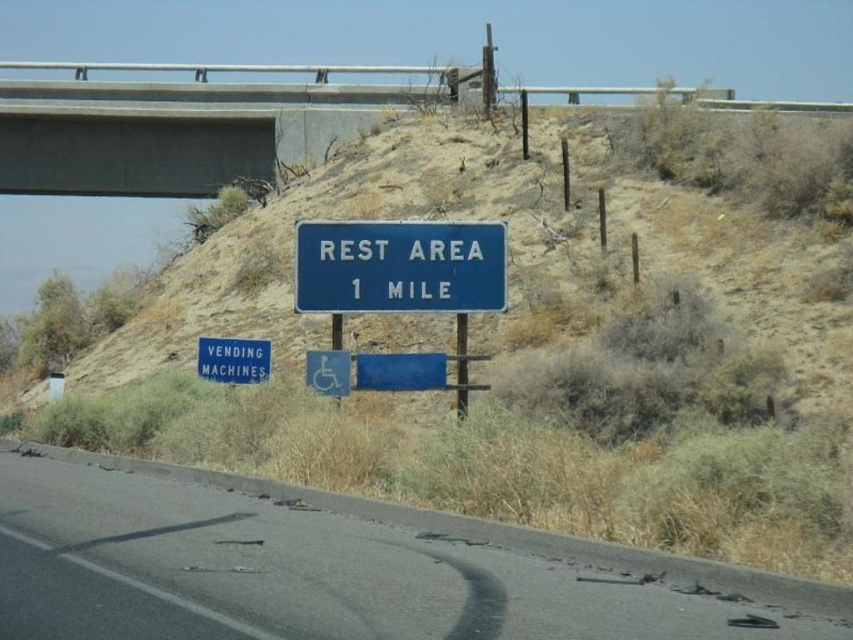
Based on the photo, is blue metallic sign at center to the right of blue metallic vending machines at lower left from the viewer's perspective?

Indeed, blue metallic sign at center is positioned on the right side of blue metallic vending machines at lower left.

In the scene shown: Between blue metallic sign at center and blue metallic vending machines at lower left, which one has less height?

Standing shorter between the two is blue metallic vending machines at lower left.

Is point (329, 232) closer to camera compared to point (221, 374)?

Yes, it is.

The width and height of the screenshot is (853, 640). I want to click on blue metallic sign at center, so click(399, 266).

Is black asphalt road at lower center thinner than blue metallic sign at center?

No.

Who is positioned more to the left, black asphalt road at lower center or blue metallic sign at center?

black asphalt road at lower center is more to the left.

Who is more forward, (816, 609) or (305, 240)?

Point (816, 609) is in front.

Where is `black asphalt road at lower center`? This screenshot has height=640, width=853. black asphalt road at lower center is located at coordinates (335, 570).

Does concrete at upper center have a greater height compared to blue metallic vending machines at lower left?

Indeed, concrete at upper center has a greater height compared to blue metallic vending machines at lower left.

What do you see at coordinates (189, 124) in the screenshot? The width and height of the screenshot is (853, 640). I see `concrete at upper center` at bounding box center [189, 124].

This screenshot has width=853, height=640. Find the location of `concrete at upper center`. concrete at upper center is located at coordinates 189,124.